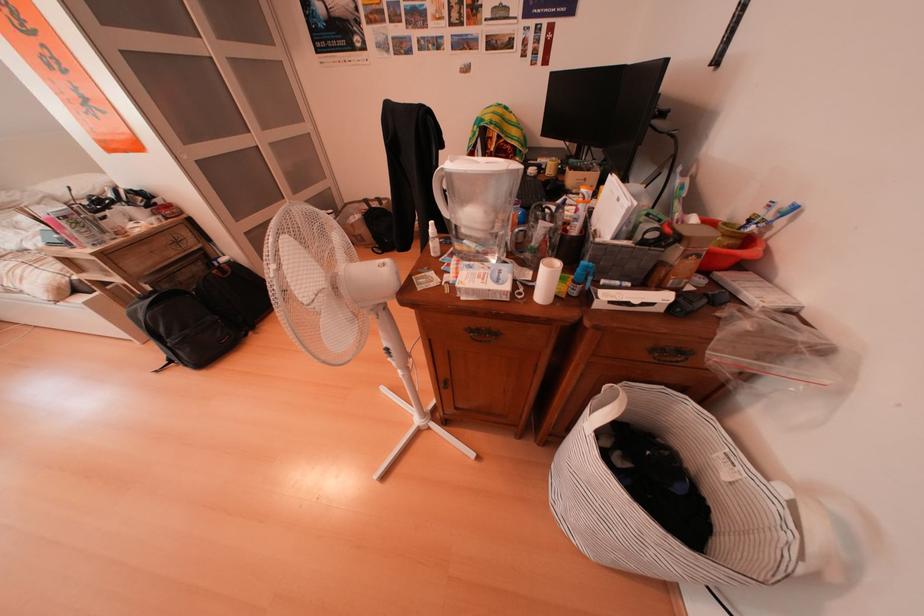
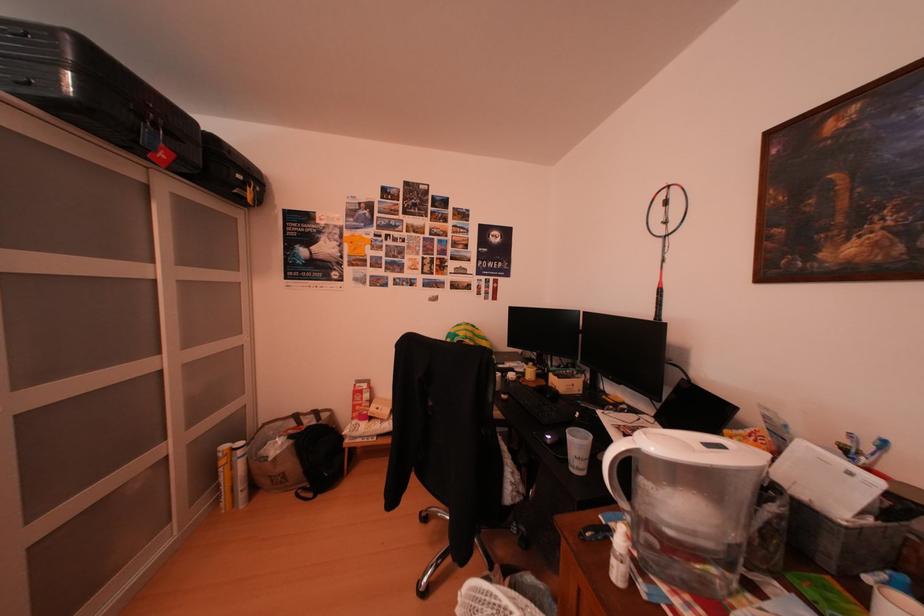
How did the camera likely rotate?

The camera rotated toward right-up.